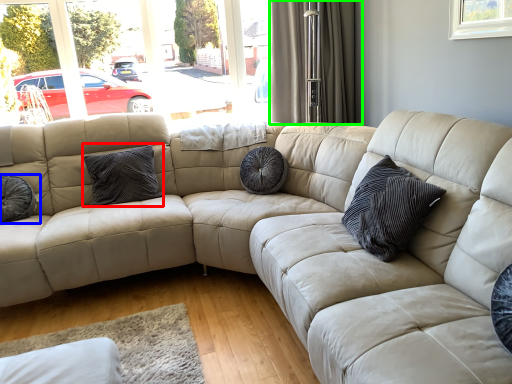
Question: Estimate the real-world distances between objects in this image. Which object is farther from pillow (highlighted by a red box), pillow (highlighted by a blue box) or curtain (highlighted by a green box)?

Choices:
 (A) pillow
 (B) curtain

Answer: (B)